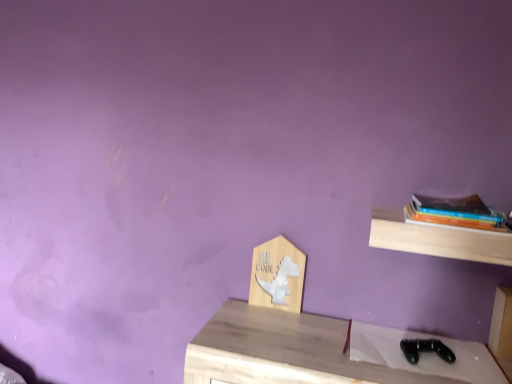
Question: From a real-world perspective, is wooden sign at center, the 2th shelf in the right-to-left sequence, above or below light wood shelf at upper right, the first shelf when ordered from right to left?

Choices:
 (A) below
 (B) above

Answer: (A)

Question: Considering the positions of wooden sign at center, which is the second shelf from front to back, and light wood shelf at upper right, the 2th shelf from the left, in the image, is wooden sign at center, which is the second shelf from front to back, wider or thinner than light wood shelf at upper right, the 2th shelf from the left,?

Choices:
 (A) thin
 (B) wide

Answer: (A)

Question: Estimate the real-world distances between objects in this image. Which object is farther from the light wood shelf at upper right, the first shelf when ordered from right to left?

Choices:
 (A) wooden sign at center, which is the second shelf from front to back
 (B) hardcover books at right

Answer: (A)

Question: Which object is positioned farthest from the hardcover books at right?

Choices:
 (A) wooden sign at center, the 2th shelf in the right-to-left sequence
 (B) light wood shelf at upper right, the 2th shelf from the left

Answer: (A)